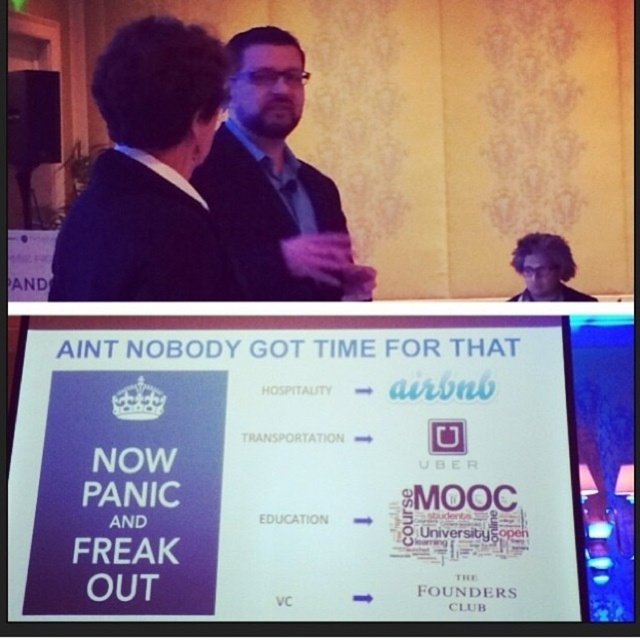
Can you confirm if matte black jacket at center is wider than purple matte business suit at upper center?

Yes.

Between point (349, 248) and point (552, 289), which one is positioned in front?

Point (349, 248) is more forward.

You are a GUI agent. You are given a task and a screenshot of the screen. Output one action in this format:
    pyautogui.click(x=<x>, y=<y>)
    Task: Click on the matte black jacket at center
    The width and height of the screenshot is (640, 640).
    Given the screenshot: What is the action you would take?
    pyautogui.click(x=275, y=180)

Between point (106, 253) and point (561, 300), which one is positioned in front?

Positioned in front is point (106, 253).

Consider the image. Is black matte suit at upper left wider than dark curly hair at upper right?

Incorrect, black matte suit at upper left's width does not surpass dark curly hair at upper right's.

Is point (156, 268) closer to camera compared to point (528, 284)?

Yes, it is.

This screenshot has height=640, width=640. Find the location of `black matte suit at upper left`. black matte suit at upper left is located at coordinates (140, 237).

Which is below, black matte suit at upper left or purple matte business suit at upper center?

purple matte business suit at upper center

Consider the image. Does black matte suit at upper left lie behind purple matte business suit at upper center?

No, black matte suit at upper left is in front of purple matte business suit at upper center.

The height and width of the screenshot is (640, 640). Describe the element at coordinates (140, 237) in the screenshot. I see `black matte suit at upper left` at that location.

In order to click on black matte suit at upper left in this screenshot , I will do `click(140, 237)`.